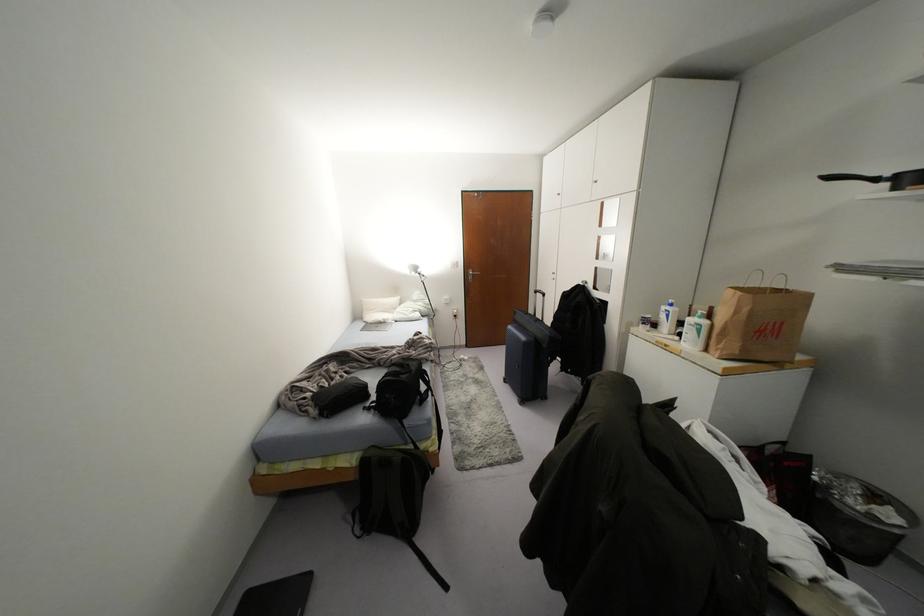
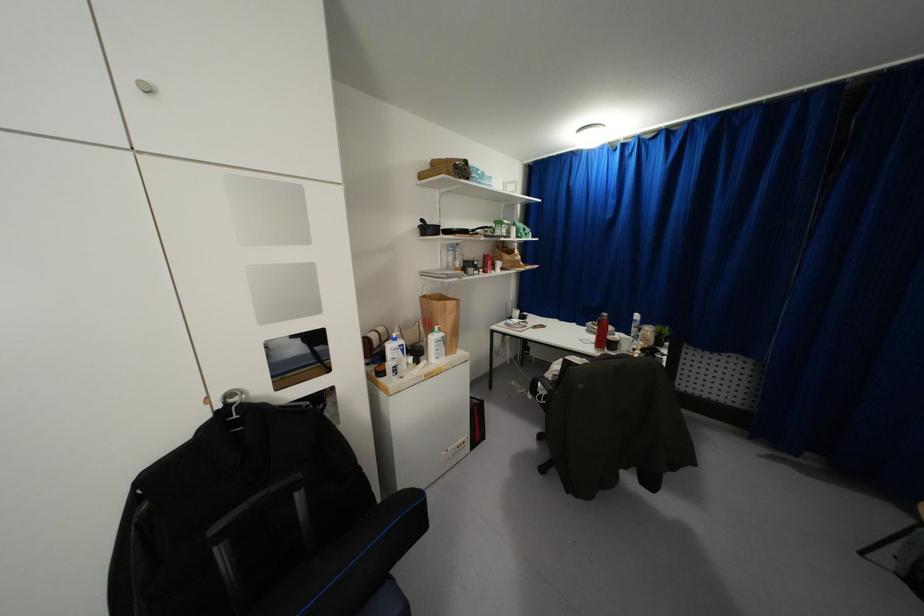
In the second image, find the point that corresponds to point 703,322 in the first image.

(442, 333)